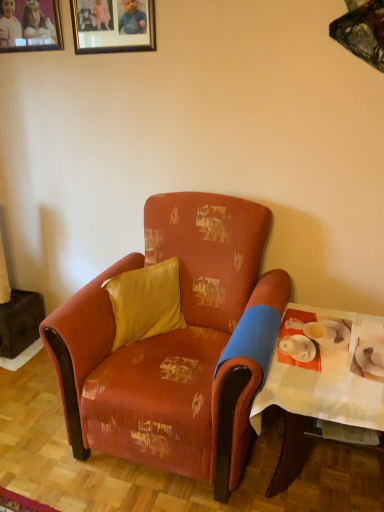
Question: From the image's perspective, does white paper table at right appear higher than matte wooden picture frame at upper left, arranged as the second picture frame when viewed from the right?

Choices:
 (A) no
 (B) yes

Answer: (A)

Question: Are white paper table at right and matte wooden picture frame at upper left, the 1th picture frame when ordered from left to right, making contact?

Choices:
 (A) no
 (B) yes

Answer: (A)

Question: Considering the relative sizes of white paper table at right and matte wooden picture frame at upper left, arranged as the second picture frame when viewed from the right, in the image provided, is white paper table at right taller than matte wooden picture frame at upper left, arranged as the second picture frame when viewed from the right,?

Choices:
 (A) no
 (B) yes

Answer: (B)

Question: Is white paper table at right at the left side of matte wooden picture frame at upper left, the 1th picture frame when ordered from left to right?

Choices:
 (A) yes
 (B) no

Answer: (B)

Question: Is the position of white paper table at right less distant than that of matte wooden picture frame at upper left, the 1th picture frame when ordered from left to right?

Choices:
 (A) yes
 (B) no

Answer: (A)

Question: Would you say white paper table at right is to the left or to the right of distressed fabric armchair at center in the picture?

Choices:
 (A) left
 (B) right

Answer: (B)

Question: Considering the positions of white paper table at right and distressed fabric armchair at center in the image, is white paper table at right wider or thinner than distressed fabric armchair at center?

Choices:
 (A) wide
 (B) thin

Answer: (B)

Question: From a real-world perspective, is white paper table at right positioned above or below distressed fabric armchair at center?

Choices:
 (A) below
 (B) above

Answer: (A)

Question: In the image, is white paper table at right positioned in front of or behind distressed fabric armchair at center?

Choices:
 (A) front
 (B) behind

Answer: (B)

Question: Looking at their shapes, would you say distressed fabric armchair at center is wider or thinner than white paper table at right?

Choices:
 (A) wide
 (B) thin

Answer: (A)

Question: Is point pyautogui.click(x=238, y=394) closer or farther from the camera than point pyautogui.click(x=326, y=354)?

Choices:
 (A) farther
 (B) closer

Answer: (B)

Question: From a real-world perspective, relative to white paper table at right, is distressed fabric armchair at center vertically above or below?

Choices:
 (A) below
 (B) above

Answer: (B)

Question: Based on their sizes in the image, would you say distressed fabric armchair at center is bigger or smaller than white paper table at right?

Choices:
 (A) big
 (B) small

Answer: (A)

Question: Is satin yellow pillow at center wider or thinner than distressed fabric armchair at center?

Choices:
 (A) wide
 (B) thin

Answer: (B)

Question: Is satin yellow pillow at center taller or shorter than distressed fabric armchair at center?

Choices:
 (A) short
 (B) tall

Answer: (A)